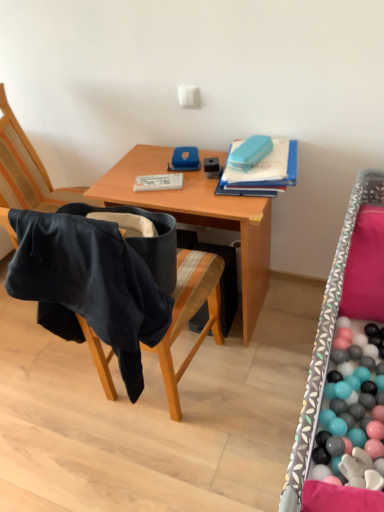
The image size is (384, 512). Identify the location of spots to the right of black fabric chair at left. (260, 379).